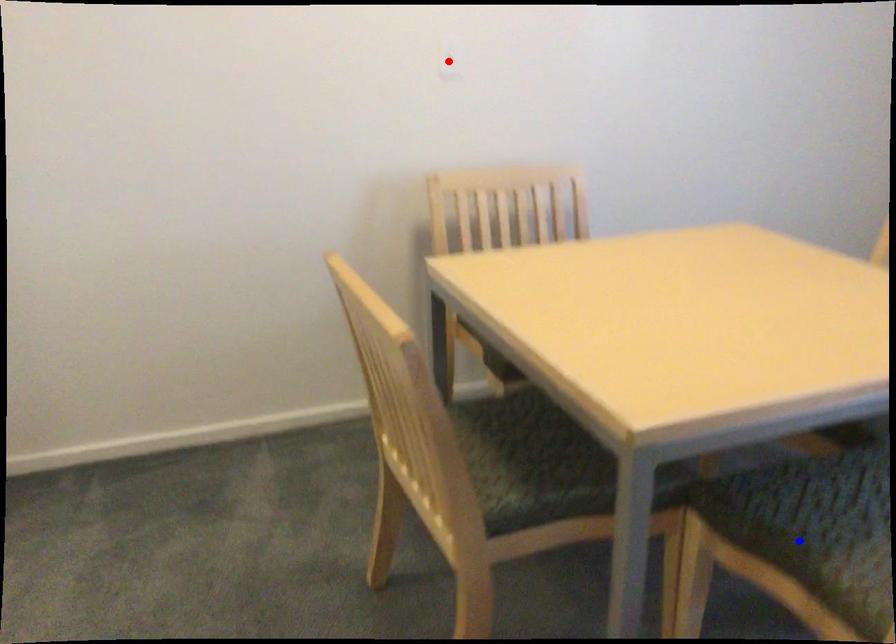
Question: Two points are marked on the image. Which point is closer to the camera?

Choices:
 (A) Blue point is closer.
 (B) Red point is closer.

Answer: (A)